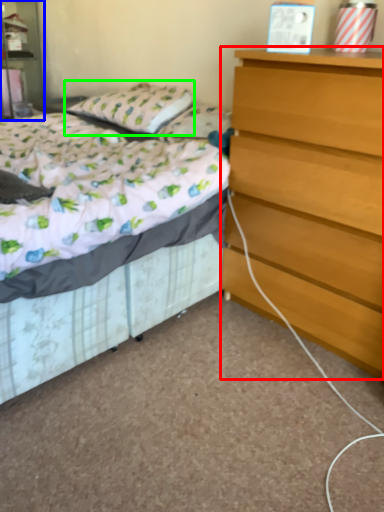
Question: Which object is the closest to the chest of drawers (highlighted by a red box)? Choose among these: nightstand (highlighted by a blue box) or pillow (highlighted by a green box).

Choices:
 (A) nightstand
 (B) pillow

Answer: (B)